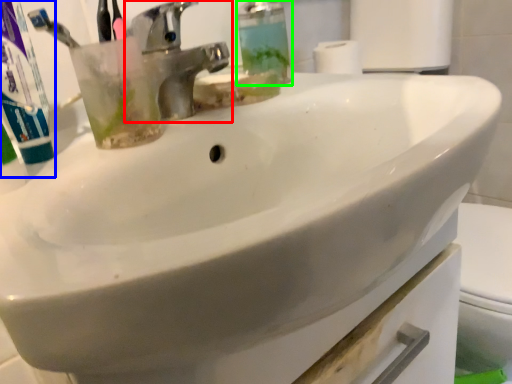
Question: Which object is the closest to the tap (highlighted by a red box)? Choose among these: toothpaste (highlighted by a blue box) or soap dispenser (highlighted by a green box).

Choices:
 (A) toothpaste
 (B) soap dispenser

Answer: (B)